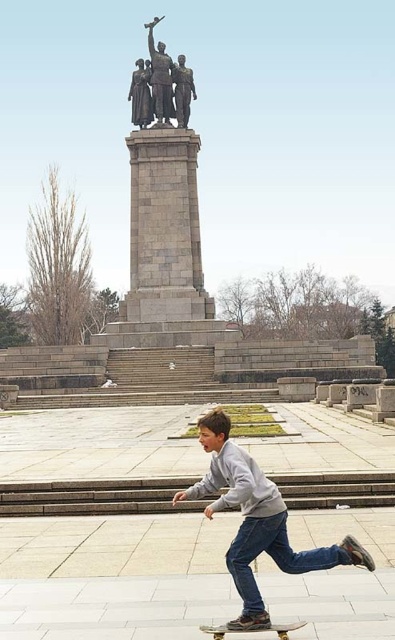
Find the location of a particular element. gray sweatshirt at lower center is located at coordinates (257, 518).

What are the coordinates of `gray sweatshirt at lower center` in the screenshot? It's located at (257, 518).

I want to click on gray sweatshirt at lower center, so click(257, 518).

Is gray sweatshirt at lower center shorter than bronze statue at center?

Indeed, gray sweatshirt at lower center has a lesser height compared to bronze statue at center.

Does gray sweatshirt at lower center appear on the left side of bronze statue at center?

In fact, gray sweatshirt at lower center is to the right of bronze statue at center.

What are the coordinates of `gray sweatshirt at lower center` in the screenshot? It's located at (257, 518).

Is polished bronze statue at upper center positioned behind polished bronze statue at center?

Yes, it is behind polished bronze statue at center.

Who is more distant from viewer, [159,80] or [193,93]?

The point [193,93] is behind.

Find the location of a particular element. This screenshot has height=640, width=395. polished bronze statue at upper center is located at coordinates (159, 77).